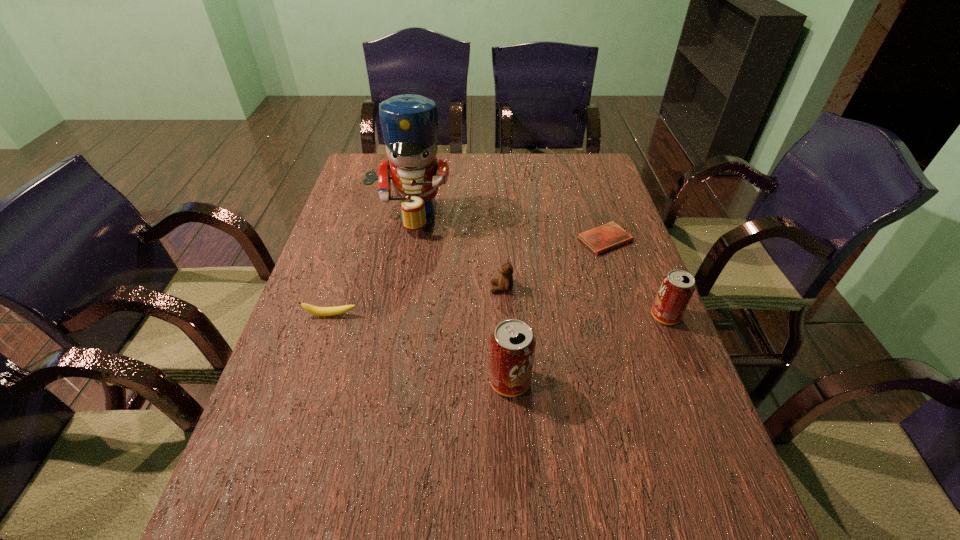
This screenshot has height=540, width=960. What are the coordinates of `the nearer soda can` in the screenshot? It's located at (512, 345).

Locate an element on the screen. This screenshot has height=540, width=960. the second tallest object is located at coordinates (512, 345).

Where is `the right soda can`? The width and height of the screenshot is (960, 540). the right soda can is located at coordinates (677, 287).

This screenshot has width=960, height=540. What are the coordinates of `the farther soda can` in the screenshot? It's located at (677, 287).

In order to click on the tallest object in this screenshot , I will do `click(409, 122)`.

Image resolution: width=960 pixels, height=540 pixels. I want to click on diary, so click(600, 239).

You are a GUI agent. You are given a task and a screenshot of the screen. Output one action in this format:
    pyautogui.click(x=<x>, y=<y>)
    Task: Click on the third farthest object
    Image resolution: width=960 pixels, height=540 pixels.
    Given the screenshot: What is the action you would take?
    pyautogui.click(x=505, y=283)

This screenshot has height=540, width=960. Find the location of `teddy bear`. teddy bear is located at coordinates (505, 283).

Locate an element on the screen. The width and height of the screenshot is (960, 540). banana is located at coordinates (319, 311).

The width and height of the screenshot is (960, 540). What are the coordinates of `vacant region located on the back of the left soda can` in the screenshot? It's located at [x=504, y=272].